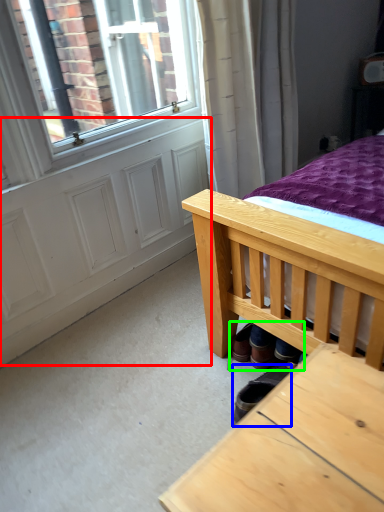
Question: Estimate the real-world distances between objects in this image. Which object is farther from screen door (highlighted by a red box), footwear (highlighted by a blue box) or shoe (highlighted by a green box)?

Choices:
 (A) footwear
 (B) shoe

Answer: (A)